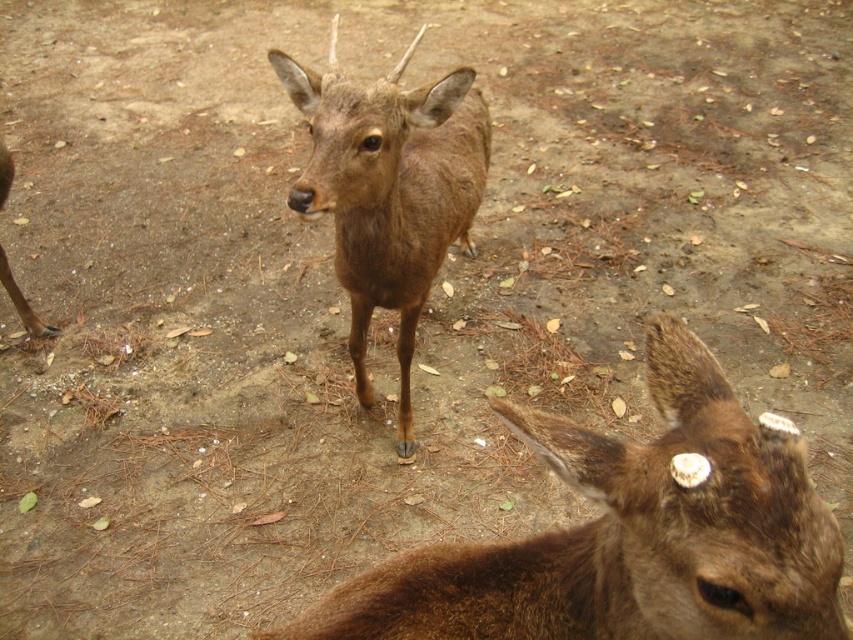
The image size is (853, 640). Describe the element at coordinates (630, 534) in the screenshot. I see `brown furry deer at center` at that location.

Is brown furry deer at center bigger than brown matte/deer at center?

Actually, brown furry deer at center might be smaller than brown matte/deer at center.

Locate an element on the screen. The height and width of the screenshot is (640, 853). brown furry deer at center is located at coordinates 630,534.